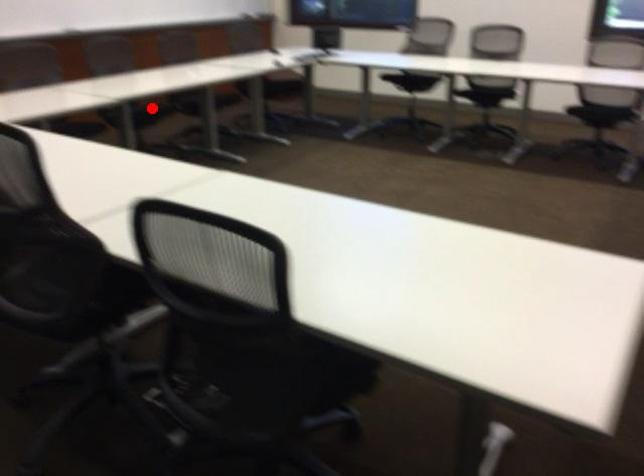
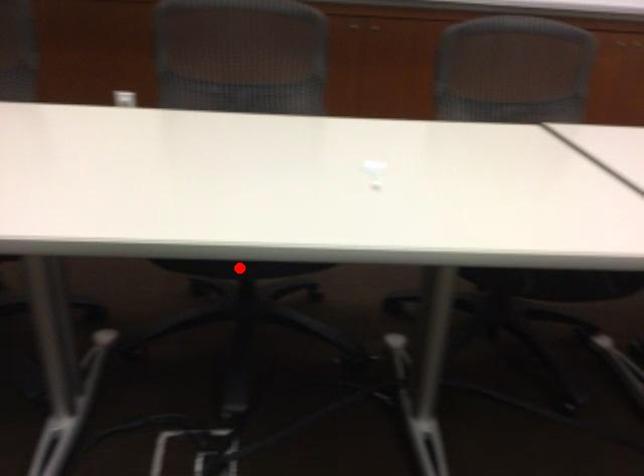
I am providing you with two images of the same scene from different viewpoints. A red point is marked on the first image and another point is marked on the second image. Does the point marked in image1 correspond to the same location as the one in image2?

Yes